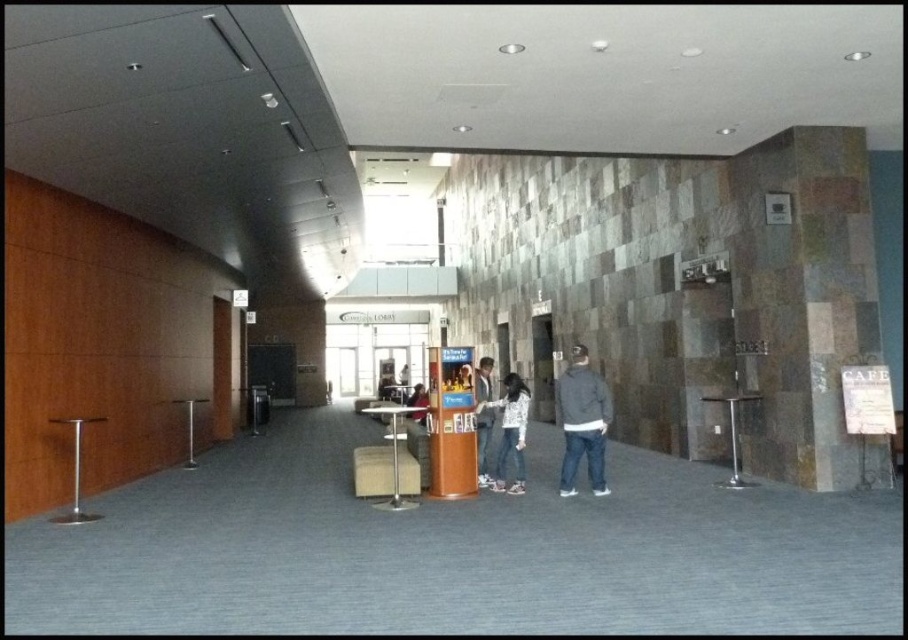
Question: Among these objects, which one is nearest to the camera?

Choices:
 (A) brown wood pillar at center
 (B) white matte jacket at center
 (C) dark gray hoodie at center
 (D) metallic silver stool at center

Answer: (D)

Question: Does dark gray hoodie at center have a smaller size compared to matte gray jacket at center?

Choices:
 (A) no
 (B) yes

Answer: (A)

Question: Where is dark gray hoodie at center located in relation to matte black jacket at center in the image?

Choices:
 (A) above
 (B) below

Answer: (A)

Question: Estimate the real-world distances between objects in this image. Which object is closer to the dark gray hoodie at center?

Choices:
 (A) matte black jacket at center
 (B) white matte jacket at center

Answer: (B)

Question: Which point appears closest to the camera in this image?

Choices:
 (A) (x=370, y=465)
 (B) (x=485, y=376)
 (C) (x=506, y=444)

Answer: (A)

Question: Is metallic silver stool at center below matte black jacket at center?

Choices:
 (A) yes
 (B) no

Answer: (B)